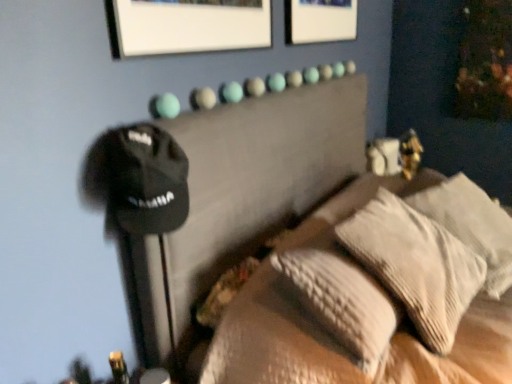
Measure the distance between point (440, 192) and camera.

They are 5.58 feet apart.

At what (x,y) coordinates should I click in order to perform the action: click on black fabric bed at upper center. Please return your answer as a coordinate pair (x, y). This screenshot has width=512, height=384. Looking at the image, I should click on (377, 291).

Describe the element at coordinates (416, 265) in the screenshot. I see `textured beige pillow at center, which is the first pillow from left to right` at that location.

The height and width of the screenshot is (384, 512). Describe the element at coordinates (376, 293) in the screenshot. I see `textured beige pillows at center` at that location.

Locate an element on the screen. This screenshot has width=512, height=384. white textured pillow at right, the first pillow positioned from the right is located at coordinates (469, 222).

Who is taller, textured beige pillows at center or textured beige pillow at center, the second pillow from the right?

With more height is textured beige pillow at center, the second pillow from the right.

The image size is (512, 384). In the image, there is a textured beige pillow at center, which is the first pillow from left to right. What are the coordinates of `bed below it (from the image's perspective)` in the screenshot? It's located at (376, 293).

Between textured beige pillows at center and textured beige pillow at center, the second pillow from the right, which one has smaller size?

Smaller between the two is textured beige pillow at center, the second pillow from the right.

Considering the sizes of objects textured beige pillow at center, the second pillow from the right, and textured beige pillows at center in the image provided, who is thinner, textured beige pillow at center, the second pillow from the right, or textured beige pillows at center?

With smaller width is textured beige pillows at center.

Locate an element on the screen. bed in front of the textured beige pillow at center, which is the first pillow from left to right is located at coordinates (376, 293).

Does textured beige pillow at center, which is the first pillow from left to right, have a greater height compared to textured beige pillows at center?

Yes, textured beige pillow at center, which is the first pillow from left to right, is taller than textured beige pillows at center.

Does point (448, 254) lie in front of point (352, 324)?

No, (448, 254) is further to viewer.

Locate an element on the screen. The height and width of the screenshot is (384, 512). furniture above the textured beige pillows at center (from the image's perspective) is located at coordinates point(377,291).

Considering the relative positions of textured beige pillows at center and black fabric bed at upper center in the image provided, is textured beige pillows at center to the right of black fabric bed at upper center from the viewer's perspective?

No.

Is textured beige pillows at center facing towards black fabric bed at upper center?

Yes, textured beige pillows at center is aimed at black fabric bed at upper center.

Is textured beige pillow at center, which is the first pillow from left to right, oriented away from black fabric bed at upper center?

Yes, textured beige pillow at center, which is the first pillow from left to right,'s orientation is away from black fabric bed at upper center.

Considering the sizes of objects textured beige pillow at center, which is the first pillow from left to right, and black fabric bed at upper center in the image provided, who is taller, textured beige pillow at center, which is the first pillow from left to right, or black fabric bed at upper center?

With more height is black fabric bed at upper center.

Does point (381, 235) appear closer or farther from the camera than point (347, 328)?

Point (381, 235) is farther from the camera than point (347, 328).

From a real-world perspective, which object rests below the other?

black fabric bed at upper center.

Is black fabric bed at upper center turned away from textured beige pillows at center?

Correct, black fabric bed at upper center is looking away from textured beige pillows at center.

From the image's perspective, which one is positioned higher, black fabric bed at upper center or textured beige pillows at center?

From the image's view, black fabric bed at upper center is above.

Can you confirm if white textured pillow at right, which is the second pillow from left to right, is positioned to the right of textured beige pillow at center, the second pillow from the right?

Correct, you'll find white textured pillow at right, which is the second pillow from left to right, to the right of textured beige pillow at center, the second pillow from the right.

How many degrees apart are the facing directions of white textured pillow at right, which is the second pillow from left to right, and textured beige pillow at center, the second pillow from the right?

There is a 22.5-degree angle between the facing directions of white textured pillow at right, which is the second pillow from left to right, and textured beige pillow at center, the second pillow from the right.

From a real-world perspective, which object stands above the other?

textured beige pillow at center, the second pillow from the right.

Is white textured pillow at right, which is the second pillow from left to right, oriented away from textured beige pillow at center, the second pillow from the right?

No.

From the picture: From a real-world perspective, who is located higher, black fabric bed at upper center or white textured pillow at right, the first pillow positioned from the right?

white textured pillow at right, the first pillow positioned from the right, from a real-world perspective.

Between black fabric bed at upper center and white textured pillow at right, which is the second pillow from left to right, which one appears on the left side from the viewer's perspective?

black fabric bed at upper center.

This screenshot has width=512, height=384. In order to click on furniture below the white textured pillow at right, which is the second pillow from left to right (from the image's perspective) in this screenshot , I will do `click(377, 291)`.

Does black fabric bed at upper center have a smaller size compared to white textured pillow at right, which is the second pillow from left to right?

No, black fabric bed at upper center is not smaller than white textured pillow at right, which is the second pillow from left to right.

Starting from the textured beige pillows at center, which pillow is the 1st one to the right? Please provide its 2D coordinates.

[(416, 265)]

The width and height of the screenshot is (512, 384). Find the location of `pillow that is the 1st one when counting upward from the textured beige pillows at center (from the image's perspective)`. pillow that is the 1st one when counting upward from the textured beige pillows at center (from the image's perspective) is located at coordinates (416, 265).

Based on their spatial positions, is black fabric bed at upper center or textured beige pillow at center, the second pillow from the right, further from white textured pillow at right, which is the second pillow from left to right?

black fabric bed at upper center is positioned further to the anchor white textured pillow at right, which is the second pillow from left to right.

Which object lies further to the anchor point textured beige pillows at center, white textured pillow at right, which is the second pillow from left to right, or textured beige pillow at center, which is the first pillow from left to right?

Based on the image, white textured pillow at right, which is the second pillow from left to right, appears to be further to textured beige pillows at center.

Estimate the real-world distances between objects in this image. Which object is further from white textured pillow at right, which is the second pillow from left to right, black fabric bed at upper center or textured beige pillows at center?

black fabric bed at upper center is further to white textured pillow at right, which is the second pillow from left to right.

Which object lies nearer to the anchor point black fabric bed at upper center, textured beige pillows at center or textured beige pillow at center, which is the first pillow from left to right?

Among the two, textured beige pillows at center is located nearer to black fabric bed at upper center.

From the picture: Considering their positions, is textured beige pillow at center, which is the first pillow from left to right, positioned further to textured beige pillows at center than black fabric bed at upper center?

The object further to textured beige pillows at center is black fabric bed at upper center.

From the image, which object appears to be nearer to textured beige pillows at center, black fabric bed at upper center or textured beige pillow at center, which is the first pillow from left to right?

textured beige pillow at center, which is the first pillow from left to right.

Which object lies further to the anchor point textured beige pillow at center, which is the first pillow from left to right, black fabric bed at upper center or white textured pillow at right, the first pillow positioned from the right?

Based on the image, white textured pillow at right, the first pillow positioned from the right, appears to be further to textured beige pillow at center, which is the first pillow from left to right.

Which object lies nearer to the anchor point white textured pillow at right, the first pillow positioned from the right, textured beige pillows at center or textured beige pillow at center, the second pillow from the right?

textured beige pillow at center, the second pillow from the right.

The width and height of the screenshot is (512, 384). Find the location of `bed between black fabric bed at upper center and textured beige pillow at center, which is the first pillow from left to right, from front to back`. bed between black fabric bed at upper center and textured beige pillow at center, which is the first pillow from left to right, from front to back is located at coordinates (376, 293).

I want to click on pillow located between textured beige pillows at center and white textured pillow at right, the first pillow positioned from the right, in the left-right direction, so click(416, 265).

Locate an element on the screen. pillow located between black fabric bed at upper center and white textured pillow at right, the first pillow positioned from the right, in the depth direction is located at coordinates (416, 265).

This screenshot has height=384, width=512. Identify the location of bed located between black fabric bed at upper center and white textured pillow at right, the first pillow positioned from the right, in the depth direction. (376, 293).